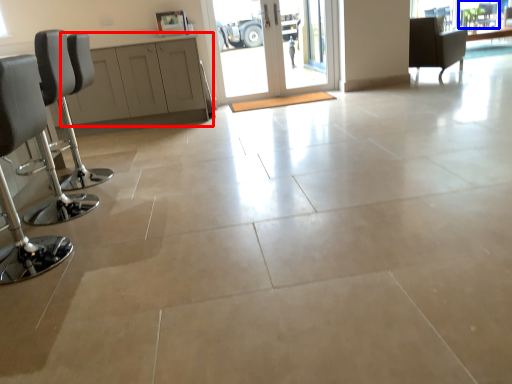
Question: Which point is further to the camera, cabinetry (highlighted by a red box) or window screen (highlighted by a blue box)?

Choices:
 (A) cabinetry
 (B) window screen

Answer: (B)